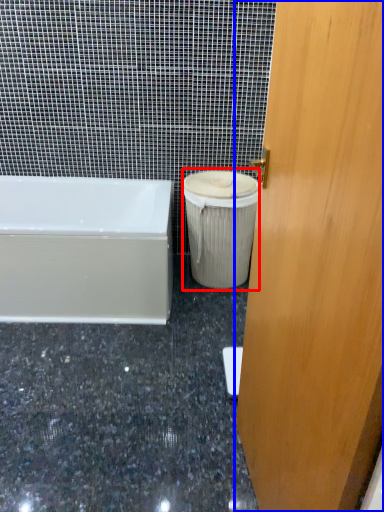
Question: Among these objects, which one is nearest to the camera, garbage (highlighted by a red box) or door (highlighted by a blue box)?

Choices:
 (A) garbage
 (B) door

Answer: (B)